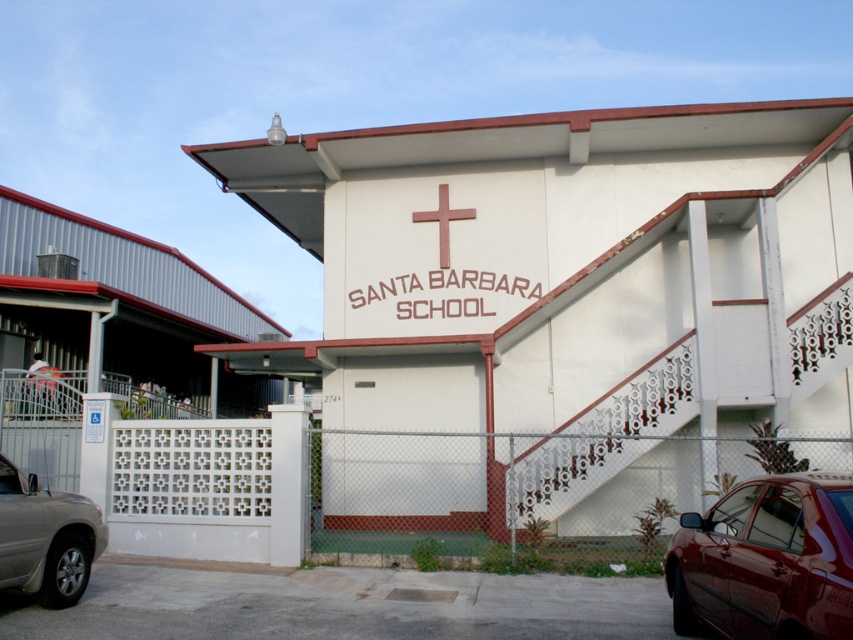
You are a visitor arriving at Santa Barbara School. You see the white matte building at center and the shiny dark red sedan at lower right. Which object is closer to the entrance of the school?

The white matte building at center is closer to the entrance of the school because it is positioned to the left of the shiny dark red sedan at lower right, which is further away from the entrance.

You are a photographer wanting to capture the white matte building at center and the shiny dark red sedan at lower right in the same frame. Considering their sizes, which object should you focus on to ensure both are clearly visible in the photo?

The white matte building at center is much taller than the shiny dark red sedan at lower right, so you should focus on the white matte building at center to ensure both are clearly visible in the photo.